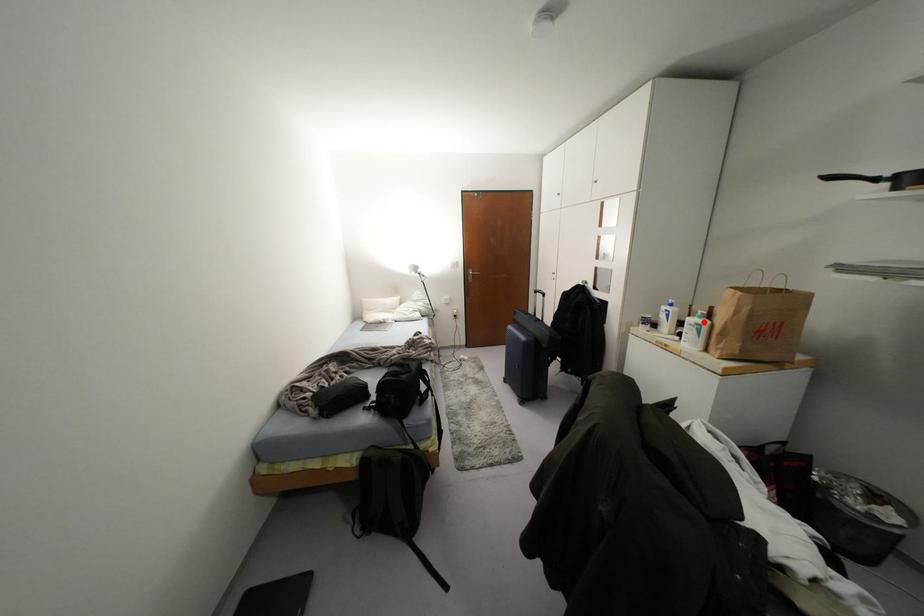
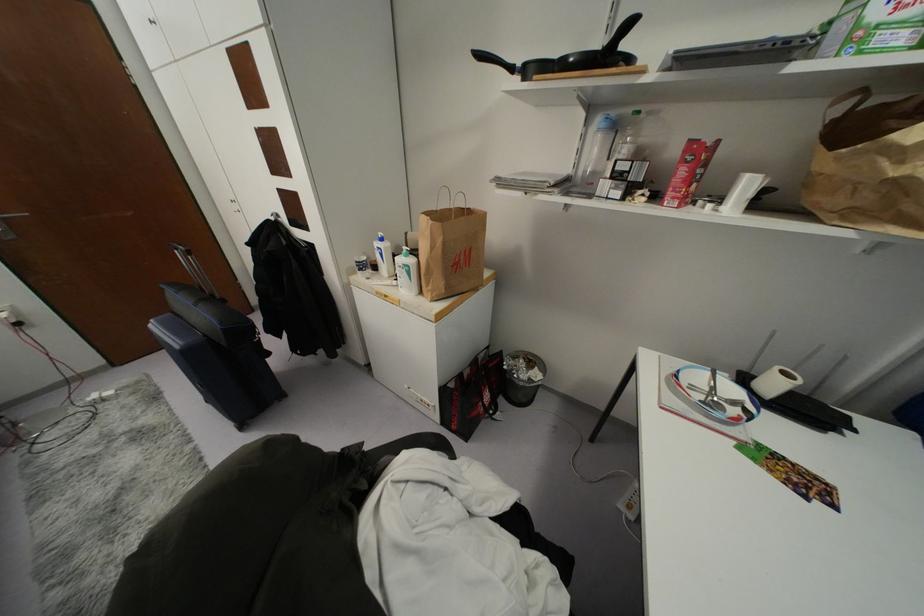
Question: I am providing you with two images of the same scene from different viewpoints. In image1, a red point is highlighted. Considering the same 3D point in image2, which of the following is correct?

Choices:
 (A) It is closer
 (B) It is farther

Answer: (B)